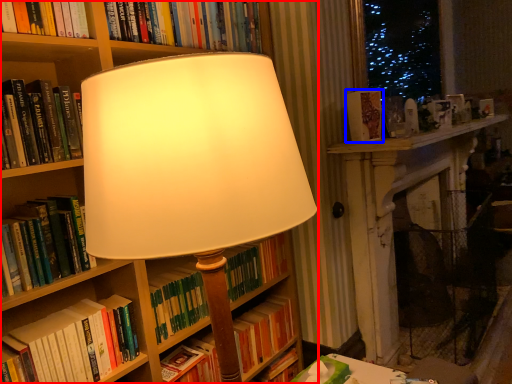
Question: Among these objects, which one is nearest to the camera, bookcase (highlighted by a red box) or book (highlighted by a blue box)?

Choices:
 (A) bookcase
 (B) book

Answer: (A)